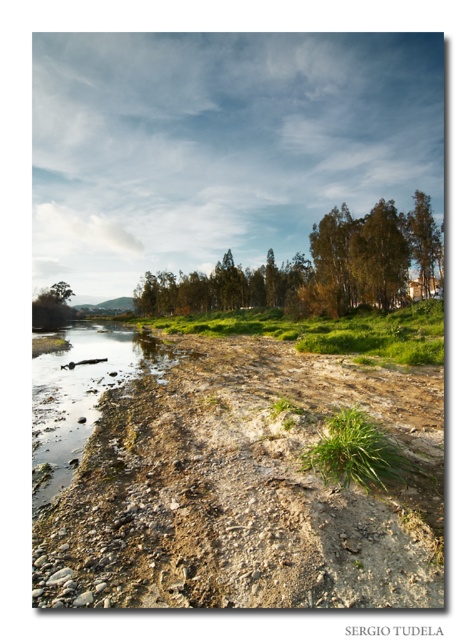
Question: Does green grassy patch at center have a greater width compared to green leafy tree at upper left?

Choices:
 (A) yes
 (B) no

Answer: (A)

Question: Which point is closer to the camera?

Choices:
 (A) (394, 276)
 (B) (288, 321)
 (C) (375, 429)
 (D) (63, 301)

Answer: (C)

Question: Is green grassy patch at center thinner than green leafy tree at upper right?

Choices:
 (A) no
 (B) yes

Answer: (A)

Question: Which of the following is the closest to the observer?

Choices:
 (A) (337, 225)
 (B) (334, 324)
 (C) (290, 468)

Answer: (C)

Question: Is brown rough dirt field at lower left below green leafy tree at upper right?

Choices:
 (A) no
 (B) yes

Answer: (B)

Question: Which of these objects is positioned farthest from the green leafy tree at upper left?

Choices:
 (A) green grassy patch at center
 (B) green leafy grass at center
 (C) green leafy tree at upper center
 (D) green leafy tree at upper right

Answer: (B)